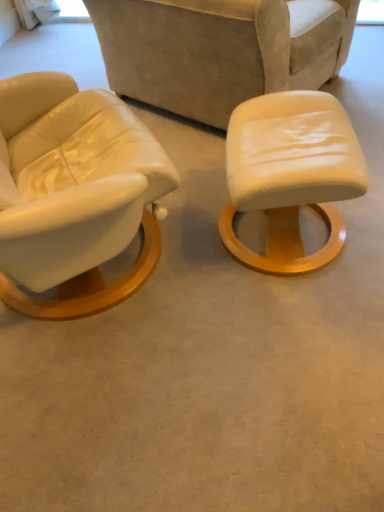
Question: Would you say matte white stool at center is a long distance from leather-like beige chair at center?

Choices:
 (A) no
 (B) yes

Answer: (A)

Question: Is matte white stool at center oriented away from leather-like beige chair at center?

Choices:
 (A) no
 (B) yes

Answer: (A)

Question: Does matte white stool at center appear on the left side of leather-like beige chair at center?

Choices:
 (A) yes
 (B) no

Answer: (B)

Question: From a real-world perspective, is matte white stool at center located beneath leather-like beige chair at center?

Choices:
 (A) no
 (B) yes

Answer: (B)

Question: Is leather-like beige chair at center located within matte white stool at center?

Choices:
 (A) no
 (B) yes

Answer: (A)

Question: Would you say matte white stool at center is outside leather-like beige chair at center?

Choices:
 (A) yes
 (B) no

Answer: (A)

Question: From a real-world perspective, is leather-like beige chair at center positioned under matte white stool at center based on gravity?

Choices:
 (A) no
 (B) yes

Answer: (A)

Question: Is matte white stool at center inside leather-like beige chair at center?

Choices:
 (A) yes
 (B) no

Answer: (B)

Question: From the image's perspective, is leather-like beige chair at center above matte white stool at center?

Choices:
 (A) yes
 (B) no

Answer: (A)

Question: Does leather-like beige chair at center have a greater height compared to matte white stool at center?

Choices:
 (A) yes
 (B) no

Answer: (A)

Question: Is leather-like beige chair at center closer to camera compared to matte white stool at center?

Choices:
 (A) yes
 (B) no

Answer: (B)

Question: Considering the relative positions of leather-like beige chair at center and matte white stool at center in the image provided, is leather-like beige chair at center to the left of matte white stool at center from the viewer's perspective?

Choices:
 (A) yes
 (B) no

Answer: (A)

Question: Looking at the image, does matte white stool at center seem bigger or smaller compared to leather-like beige chair at center?

Choices:
 (A) big
 (B) small

Answer: (B)